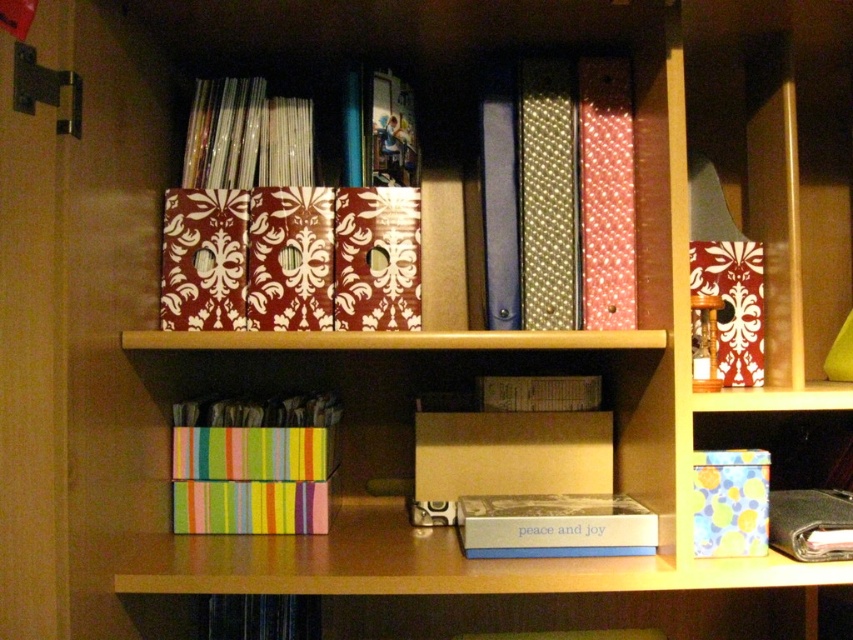
You are standing 3 feet away from the wooden shelving unit. If you want to reach the point at coordinates point (535,538), will you be able to touch it with your outstretched hand?

The distance of point (535,538) from viewer is 36.42 inches. Since you are standing 3 feet away, which is 36 inches, you can just barely touch it with your outstretched hand as the distance is slightly more than your reach.

You are standing in front of the shelving unit and want to reach both points. Which point, point (614, 97) or point (544, 545), will you reach first?

Point (614, 97) is further to the viewer than point (544, 545), so you will reach point (614, 97) first.